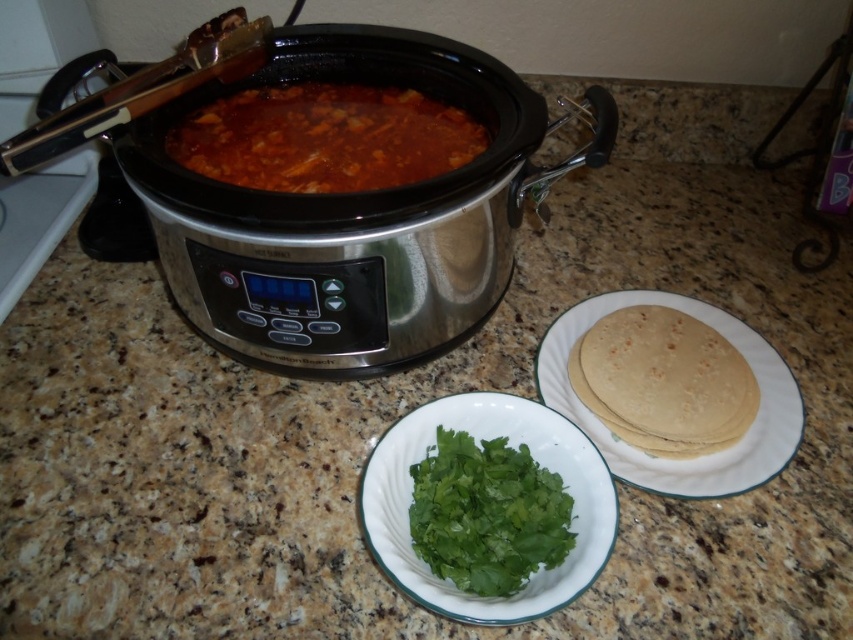
Is stainless steel slow cooker at center thinner than green leafy herb at center?

In fact, stainless steel slow cooker at center might be wider than green leafy herb at center.

Is stainless steel slow cooker at center to the left of green leafy herb at center from the viewer's perspective?

Indeed, stainless steel slow cooker at center is positioned on the left side of green leafy herb at center.

You are a GUI agent. You are given a task and a screenshot of the screen. Output one action in this format:
    pyautogui.click(x=<x>, y=<y>)
    Task: Click on the stainless steel slow cooker at center
    This screenshot has height=640, width=853.
    Given the screenshot: What is the action you would take?
    pyautogui.click(x=352, y=216)

Does brown matte stew at center have a larger size compared to green leafy herb at center?

Yes.

Who is lower down, brown matte stew at center or green leafy herb at center?

green leafy herb at center is lower down.

The width and height of the screenshot is (853, 640). Identify the location of brown matte stew at center. (325, 138).

Who is lower down, green leafy herb at center or green leafy at center?

green leafy herb at center is below.

Which of these two, green leafy herb at center or green leafy at center, stands shorter?

green leafy at center

Is point (397, 557) closer to camera compared to point (467, 541)?

Yes.

Identify the location of green leafy herb at center. (477, 442).